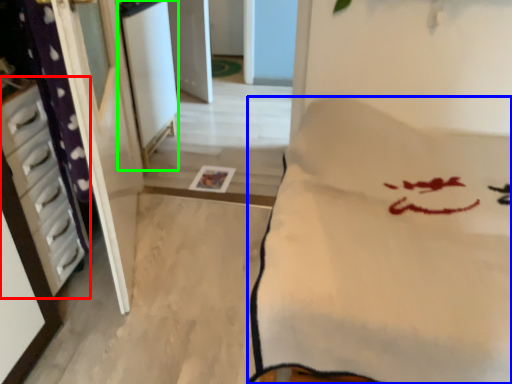
Question: Which object is positioned farthest from furniture (highlighted by a red box)? Select from furniture (highlighted by a blue box) and screen door (highlighted by a green box).

Choices:
 (A) furniture
 (B) screen door

Answer: (B)